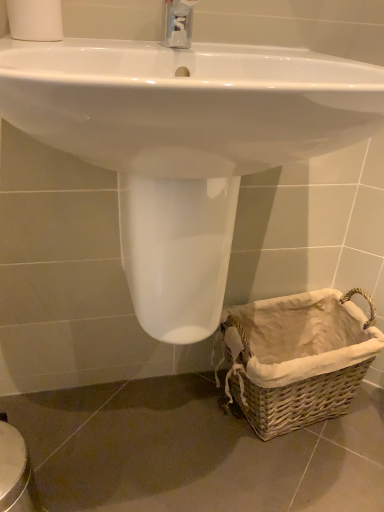
What is the approximate width of white glossy sink at center?

white glossy sink at center is 46.07 centimeters wide.

What do you see at coordinates (297, 357) in the screenshot?
I see `woven brown basket at lower right` at bounding box center [297, 357].

You are a GUI agent. You are given a task and a screenshot of the screen. Output one action in this format:
    pyautogui.click(x=<x>, y=<y>)
    Task: Click on the white glossy sink at center
    This screenshot has height=512, width=384.
    Given the screenshot: What is the action you would take?
    pyautogui.click(x=184, y=145)

From the image's perspective, between white glossy sink at center and woven brown basket at lower right, which one is located above?

white glossy sink at center is shown above in the image.

Can you tell me how much white glossy sink at center and woven brown basket at lower right differ in facing direction?

9.22 degrees separate the facing orientations of white glossy sink at center and woven brown basket at lower right.

Is white glossy sink at center positioned far away from woven brown basket at lower right?

No, there isn't a large distance between white glossy sink at center and woven brown basket at lower right.

Is white glossy sink at center positioned beyond the bounds of woven brown basket at lower right?

Yes, white glossy sink at center is located beyond the bounds of woven brown basket at lower right.

Who is more distant, woven brown basket at lower right or white matte toilet paper at upper left?

woven brown basket at lower right.

Considering the relative sizes of woven brown basket at lower right and white matte toilet paper at upper left in the image provided, is woven brown basket at lower right wider than white matte toilet paper at upper left?

Yes.

Does point (357, 371) appear closer or farther from the camera than point (51, 29)?

Point (357, 371).

Is white matte toilet paper at upper left at the back of woven brown basket at lower right?

woven brown basket at lower right does not have its back to white matte toilet paper at upper left.

Is white glossy sink at center next to white matte toilet paper at upper left and touching it?

white glossy sink at center and white matte toilet paper at upper left are clearly separated.

In the scene shown: From a real-world perspective, does white glossy sink at center stand above white matte toilet paper at upper left?

Actually, white glossy sink at center is physically below white matte toilet paper at upper left in the real world.

Can you confirm if white glossy sink at center is positioned to the left of white matte toilet paper at upper left?

No.

Considering the sizes of white glossy sink at center and white matte toilet paper at upper left in the image, is white glossy sink at center bigger or smaller than white matte toilet paper at upper left?

white glossy sink at center is bigger than white matte toilet paper at upper left.

Is white matte toilet paper at upper left placed right next to woven brown basket at lower right?

No, white matte toilet paper at upper left is not next to woven brown basket at lower right.

How many degrees apart are the facing directions of white matte toilet paper at upper left and woven brown basket at lower right?

They differ by 7.87 degrees in their facing directions.

In terms of size, does white matte toilet paper at upper left appear bigger or smaller than woven brown basket at lower right?

Considering their sizes, white matte toilet paper at upper left takes up less space than woven brown basket at lower right.

From the image's perspective, would you say white matte toilet paper at upper left is positioned over woven brown basket at lower right?

Yes.

From the image's perspective, is white matte toilet paper at upper left below white glossy sink at center?

No, from the image's perspective, white matte toilet paper at upper left is not beneath white glossy sink at center.

Considering the positions of objects white matte toilet paper at upper left and white glossy sink at center in the image provided, who is in front, white matte toilet paper at upper left or white glossy sink at center?

white glossy sink at center is in front.

Considering the relative sizes of white matte toilet paper at upper left and white glossy sink at center in the image provided, is white matte toilet paper at upper left taller than white glossy sink at center?

No, white matte toilet paper at upper left is not taller than white glossy sink at center.

Which object is positioned more to the right, white matte toilet paper at upper left or white glossy sink at center?

Positioned to the right is white glossy sink at center.

Who is smaller, woven brown basket at lower right or white glossy sink at center?

Smaller between the two is woven brown basket at lower right.

Is woven brown basket at lower right aimed at white glossy sink at center?

No, woven brown basket at lower right is not oriented towards white glossy sink at center.

From a real-world perspective, which is physically above, woven brown basket at lower right or white glossy sink at center?

white glossy sink at center is physically above.

Identify the location of sink that appears above the woven brown basket at lower right (from the image's perspective). (184, 145).

I want to click on basket on the right of white glossy sink at center, so click(297, 357).

Find the location of a particular element. This screenshot has height=512, width=384. toilet paper above the woven brown basket at lower right (from the image's perspective) is located at coordinates (35, 20).

In the scene shown: Based on their spatial positions, is white glossy sink at center or white matte toilet paper at upper left further from woven brown basket at lower right?

white matte toilet paper at upper left.

Estimate the real-world distances between objects in this image. Which object is closer to white matte toilet paper at upper left, woven brown basket at lower right or white glossy sink at center?

Among the two, white glossy sink at center is located nearer to white matte toilet paper at upper left.

Based on their spatial positions, is white matte toilet paper at upper left or white glossy sink at center further from woven brown basket at lower right?

Based on the image, white matte toilet paper at upper left appears to be further to woven brown basket at lower right.

Which object lies nearer to the anchor point white glossy sink at center, white matte toilet paper at upper left or woven brown basket at lower right?

white matte toilet paper at upper left is closer to white glossy sink at center.

Looking at the image, which one is located closer to white glossy sink at center, woven brown basket at lower right or white matte toilet paper at upper left?

white matte toilet paper at upper left is closer to white glossy sink at center.

When comparing their distances from white matte toilet paper at upper left, does white glossy sink at center or woven brown basket at lower right seem further?

woven brown basket at lower right lies further to white matte toilet paper at upper left than the other object.

Locate an element on the screen. The height and width of the screenshot is (512, 384). sink that lies between white matte toilet paper at upper left and woven brown basket at lower right from top to bottom is located at coordinates (184, 145).